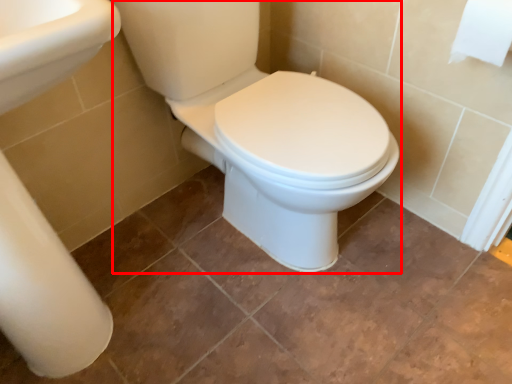
Question: Observing the image, what is the correct spatial positioning of porcelain (annotated by the red box) in reference to toilet paper?

Choices:
 (A) right
 (B) left

Answer: (B)